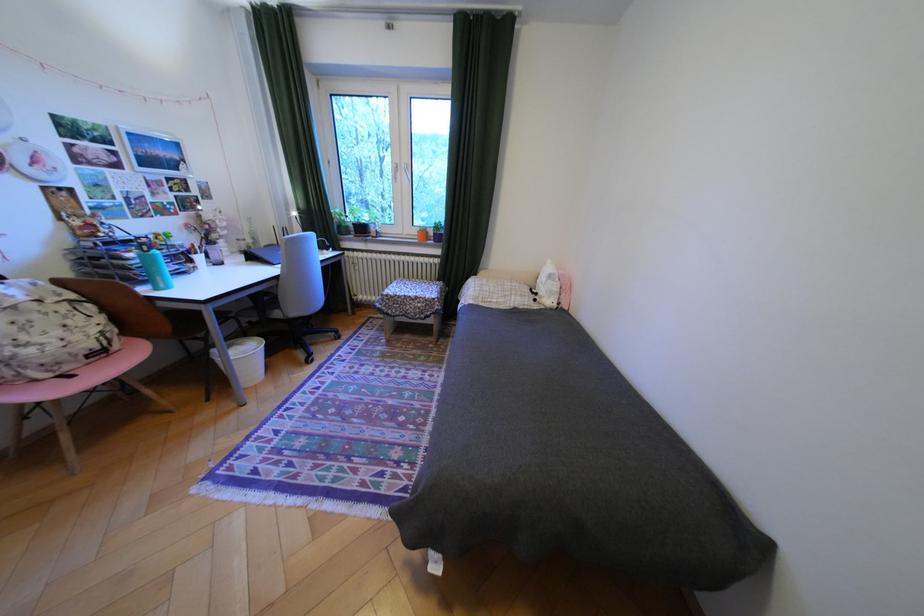
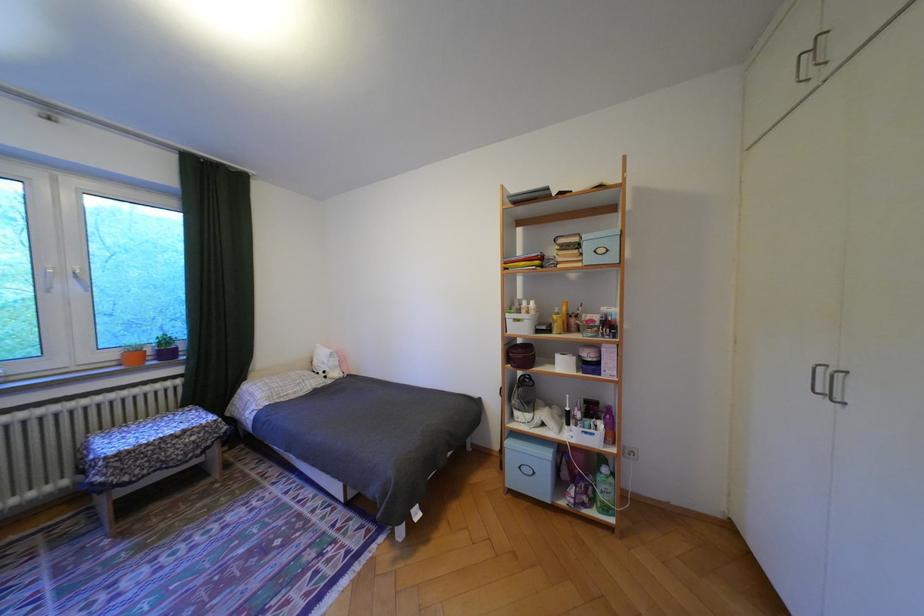
The point at [427,232] is marked in the first image. Where is the corresponding point in the second image?

(124, 355)